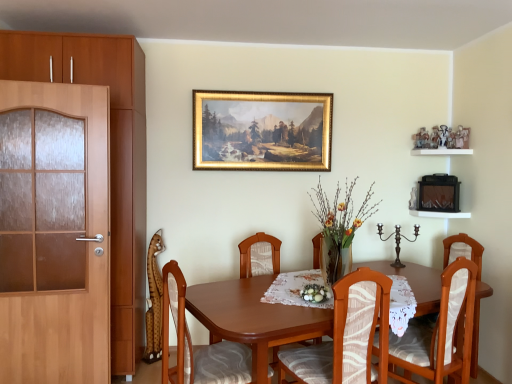
Where is `vacant space situated above gold-framed painting at upper center (from a real-world perspective)`? This screenshot has width=512, height=384. vacant space situated above gold-framed painting at upper center (from a real-world perspective) is located at coordinates (265, 90).